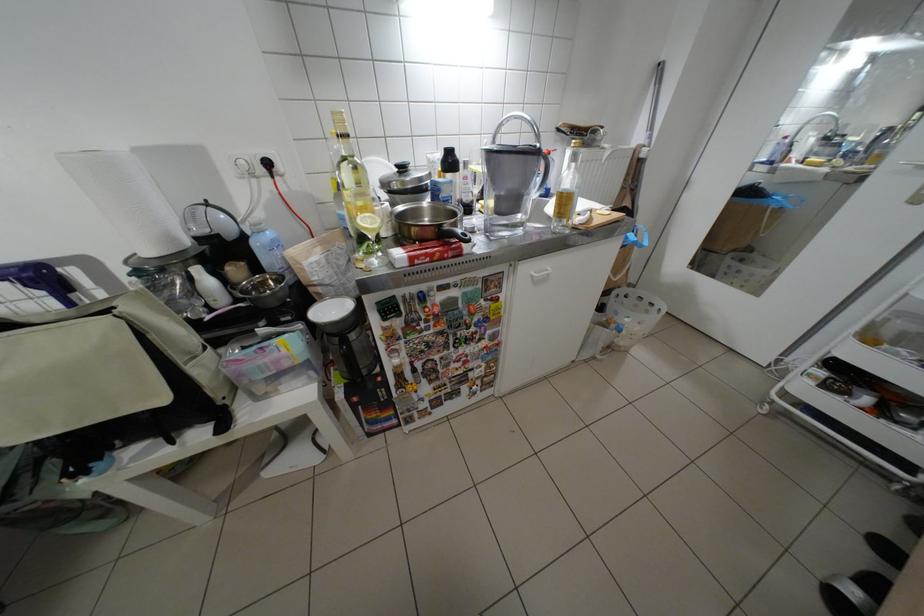
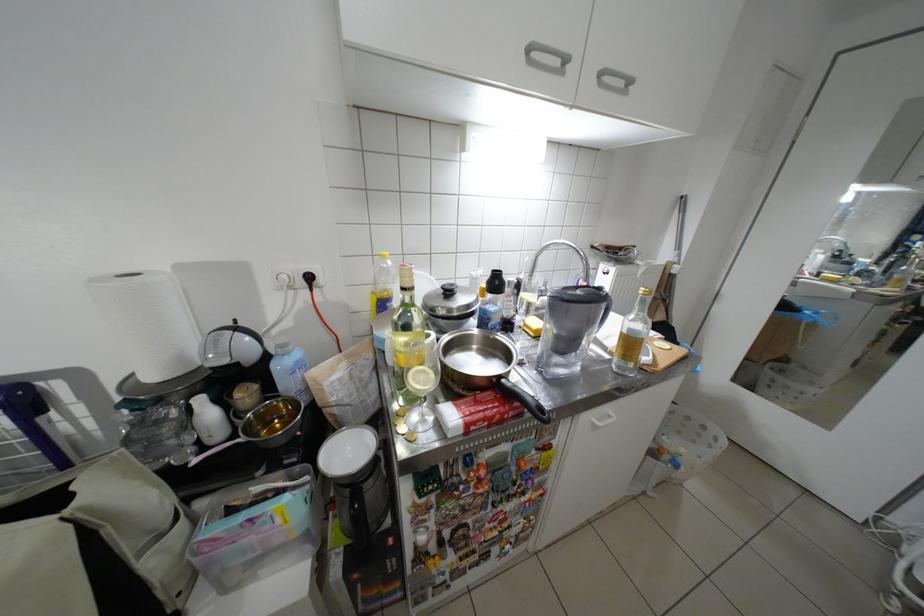
Locate, in the second image, the point that corresponds to pixel 273 171 in the first image.

(312, 285)